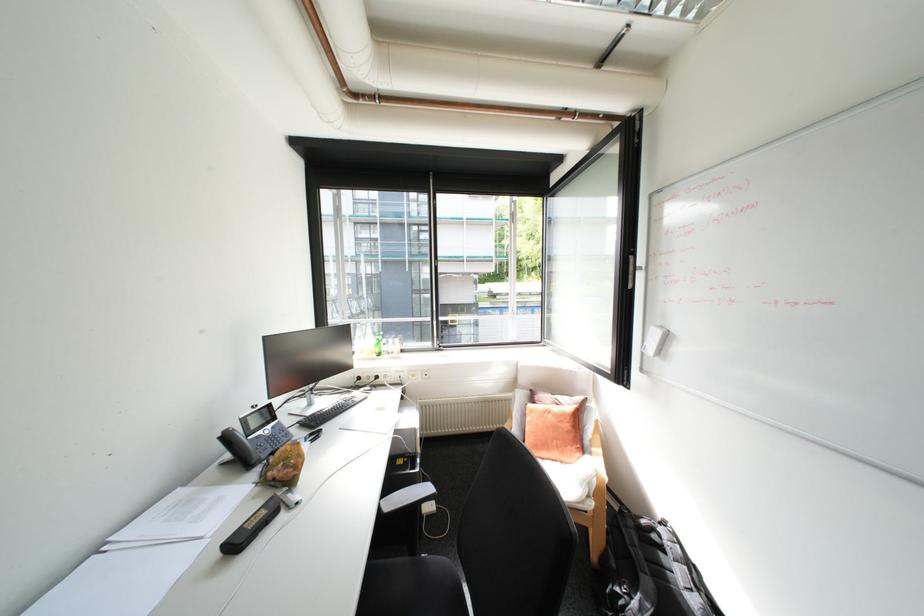
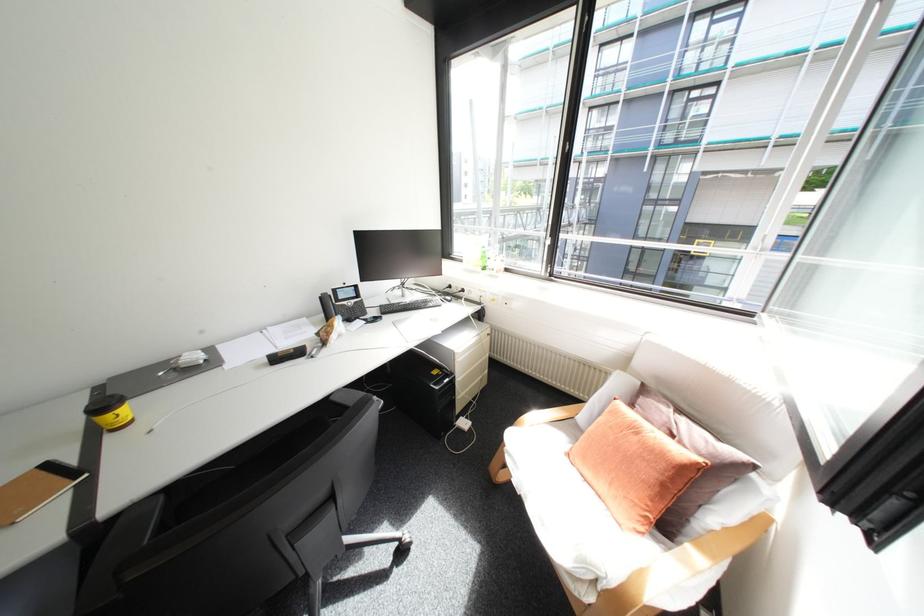
Find the pixel in the second image that matches (x=321, y=415) in the first image.

(403, 304)